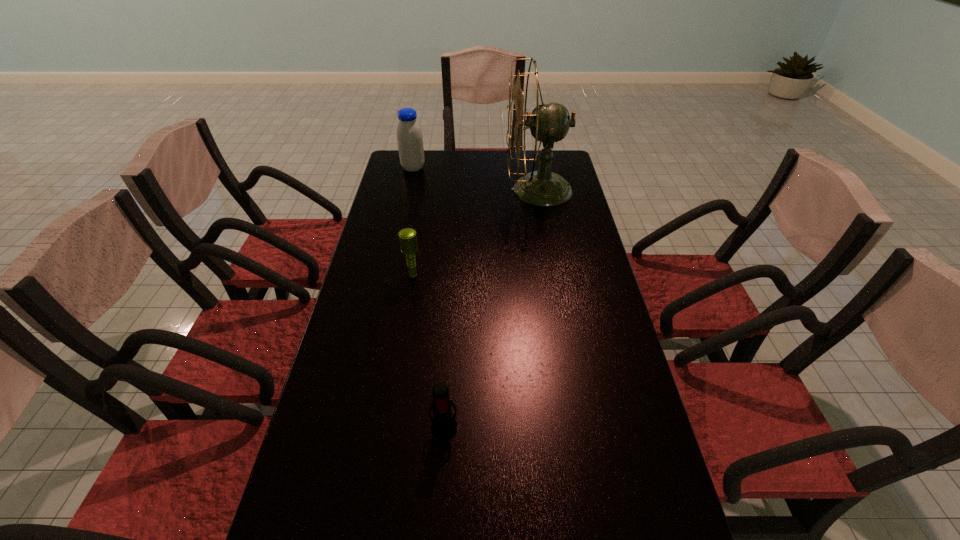
Identify the location of the rightmost object. The height and width of the screenshot is (540, 960). (549, 122).

At what (x,y) coordinates should I click in order to perform the action: click on the tallest object. Please return your answer as a coordinate pair (x, y). Looking at the image, I should click on (549, 122).

Image resolution: width=960 pixels, height=540 pixels. What are the coordinates of `soya milk` in the screenshot? It's located at (409, 134).

Find the location of `the third farthest object`. the third farthest object is located at coordinates (408, 239).

This screenshot has height=540, width=960. What are the coordinates of `the left microphone` in the screenshot? It's located at pos(408,239).

You are a GUI agent. You are given a task and a screenshot of the screen. Output one action in this format:
    pyautogui.click(x=<x>, y=<y>)
    Task: Click on the nearest object
    
    Given the screenshot: What is the action you would take?
    pyautogui.click(x=444, y=426)

What are the coordinates of `the nearer microphone` in the screenshot? It's located at (444, 426).

You are a GUI agent. You are given a task and a screenshot of the screen. Output one action in this format:
    pyautogui.click(x=<x>, y=<y>)
    Task: Click on the free space located in front of the rightmost object, directing air flow
    
    Given the screenshot: What is the action you would take?
    pyautogui.click(x=483, y=190)

I want to click on vacant region located in front of the rightmost object, directing air flow, so click(x=408, y=190).

Identify the location of free region located in front of the rightmost object, directing air flow. The width and height of the screenshot is (960, 540). (416, 190).